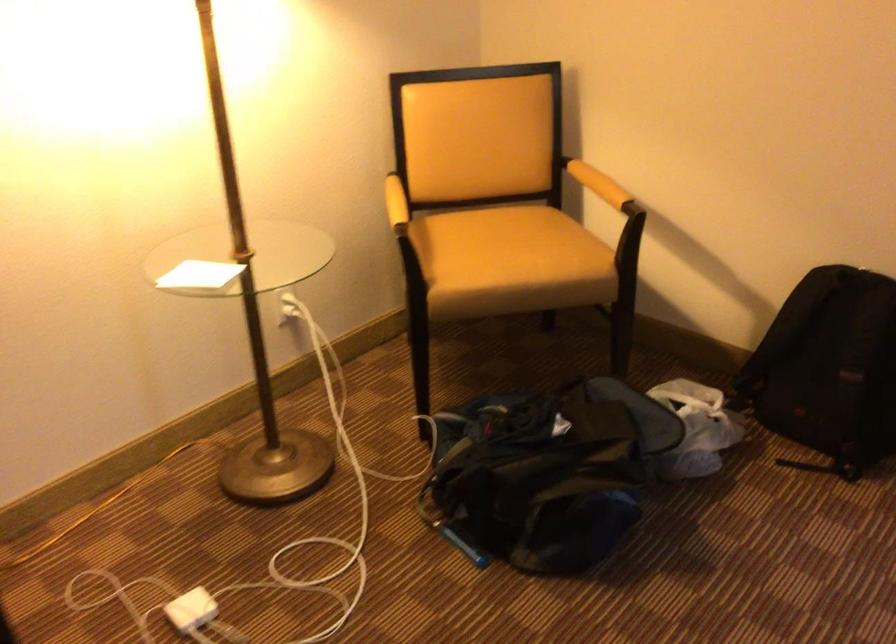
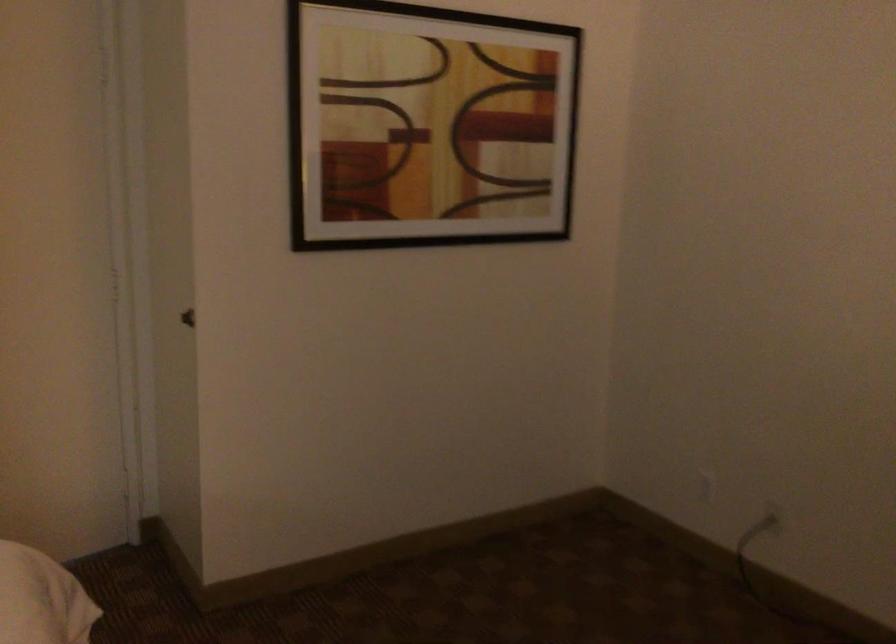
First-person continuous shooting, in which direction is the camera rotating?

The camera's rotation is toward left-down.